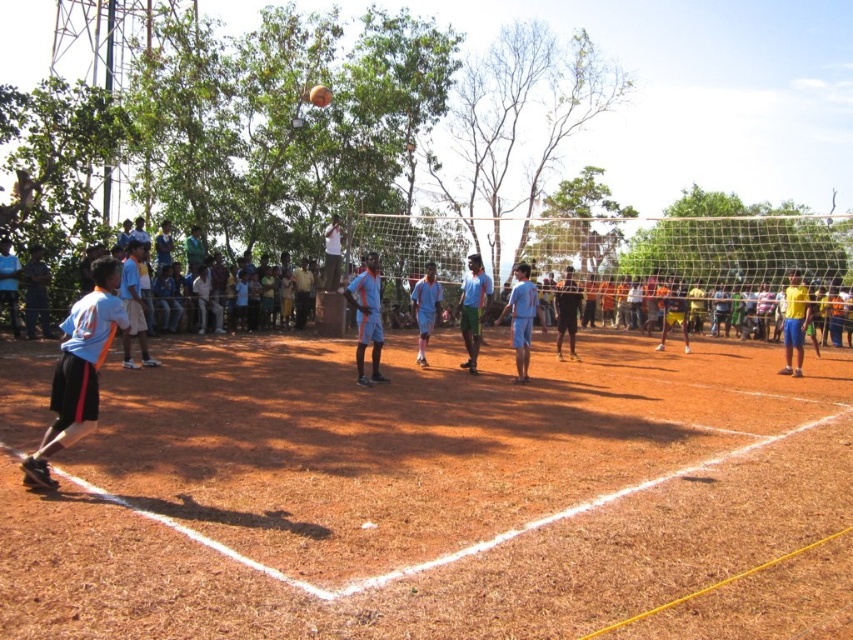
Who is lower down, light blue jersey at left or blue jersey at center?

Positioned lower is light blue jersey at left.

Locate an element on the screen. The width and height of the screenshot is (853, 640). light blue jersey at left is located at coordinates (79, 369).

The height and width of the screenshot is (640, 853). In order to click on light blue jersey at left in this screenshot , I will do `click(79, 369)`.

In the scene shown: Who is positioned more to the right, brown dirt field at center or yellow fabric shorts at right?

From the viewer's perspective, yellow fabric shorts at right appears more on the right side.

Between point (173, 570) and point (786, 356), which one is positioned behind?

Point (786, 356)

Where is `brown dirt field at center`? brown dirt field at center is located at coordinates (413, 486).

Between light blue jersey at left and yellow fabric shorts at right, which one is positioned lower?

light blue jersey at left is below.

Who is more forward, [115,262] or [798,314]?

Point [115,262] is more forward.

Does point (73, 396) come in front of point (791, 340)?

Yes, point (73, 396) is in front of point (791, 340).

Image resolution: width=853 pixels, height=640 pixels. I want to click on light blue jersey at left, so click(x=79, y=369).